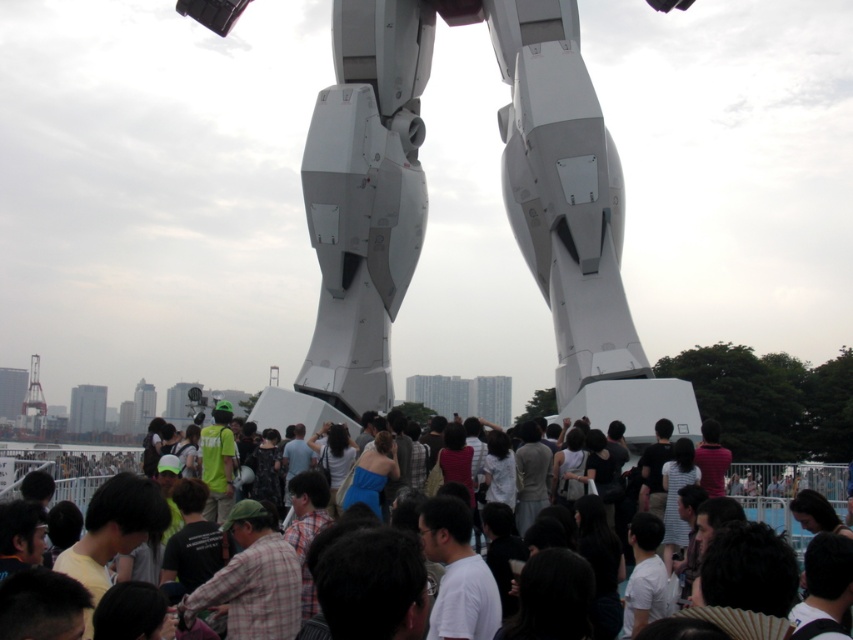
Can you confirm if white matte robot legs at center is positioned below matte white crowd at center?

Actually, white matte robot legs at center is above matte white crowd at center.

Is point (424, 49) positioned in front of point (799, 481)?

No, (424, 49) is further to viewer.

The height and width of the screenshot is (640, 853). I want to click on white matte robot legs at center, so click(x=503, y=202).